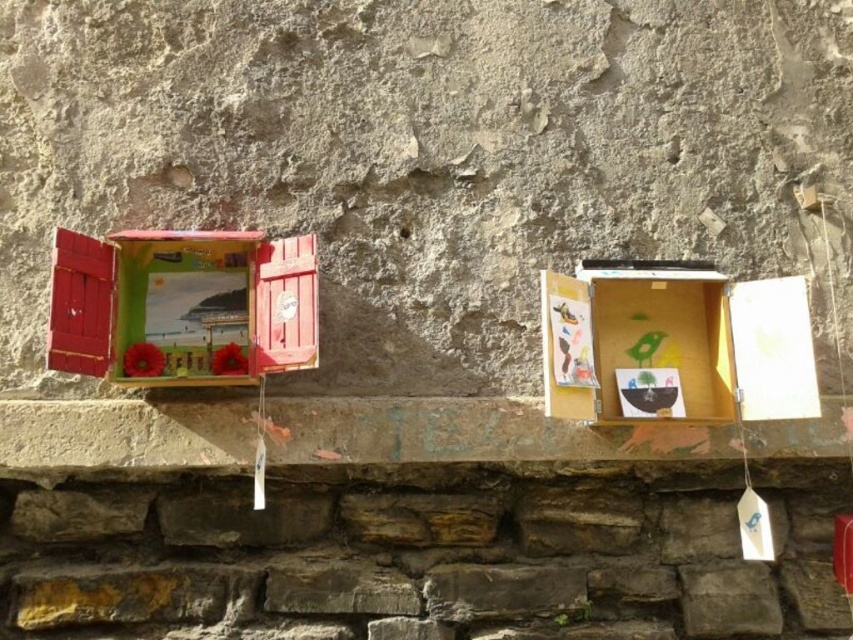
You are an interior designer assessing the wall decorations. You need to know which object is taller between the matte wooden window at left and the wooden box at center. Can you determine this based on their positions?

The matte wooden window at left is much taller than the wooden box at center, so the matte wooden window at left is taller.

You are standing in front of the image and want to locate the smooth stone ledge at center. Can you tell me the exact coordinates of its position?

The smooth stone ledge at center is located at the 2D coordinates of point (469, 433).

You are a painter who wants to place a small statue on a surface that can support it. Based on the scene, which object between the smooth stone ledge at center and the wooden box at center is more suitable for placing the statue?

The wooden box at center is more suitable for placing the statue because it has a greater height than the smooth stone ledge at center, providing a stable and elevated surface.